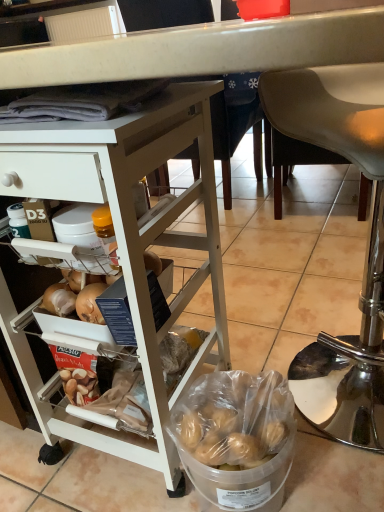
Question: Can you confirm if clear plastic bucket at lower center is taller than white matte desk at upper left?

Choices:
 (A) yes
 (B) no

Answer: (B)

Question: Is clear plastic bucket at lower center facing towards white matte desk at upper left?

Choices:
 (A) no
 (B) yes

Answer: (A)

Question: Does clear plastic bucket at lower center have a lesser width compared to white matte desk at upper left?

Choices:
 (A) yes
 (B) no

Answer: (A)

Question: Is the depth of clear plastic bucket at lower center greater than that of white matte desk at upper left?

Choices:
 (A) yes
 (B) no

Answer: (A)

Question: Can you confirm if clear plastic bucket at lower center is bigger than white matte desk at upper left?

Choices:
 (A) yes
 (B) no

Answer: (B)

Question: From the image's perspective, is clear plastic bucket at lower center on white matte desk at upper left?

Choices:
 (A) yes
 (B) no

Answer: (B)

Question: Is metallic silver chair at lower right shorter than white matte desk at upper left?

Choices:
 (A) yes
 (B) no

Answer: (A)

Question: From the image's perspective, is metallic silver chair at lower right located above white matte desk at upper left?

Choices:
 (A) no
 (B) yes

Answer: (B)

Question: Considering the relative sizes of metallic silver chair at lower right and white matte desk at upper left in the image provided, is metallic silver chair at lower right wider than white matte desk at upper left?

Choices:
 (A) yes
 (B) no

Answer: (B)

Question: Can you confirm if metallic silver chair at lower right is positioned to the right of white matte desk at upper left?

Choices:
 (A) no
 (B) yes

Answer: (B)

Question: Can you confirm if metallic silver chair at lower right is thinner than white matte desk at upper left?

Choices:
 (A) no
 (B) yes

Answer: (B)

Question: Does metallic silver chair at lower right lie behind white matte desk at upper left?

Choices:
 (A) no
 (B) yes

Answer: (B)

Question: Considering the relative positions of clear plastic bucket at lower center and metallic silver chair at lower right in the image provided, is clear plastic bucket at lower center in front of metallic silver chair at lower right?

Choices:
 (A) yes
 (B) no

Answer: (B)